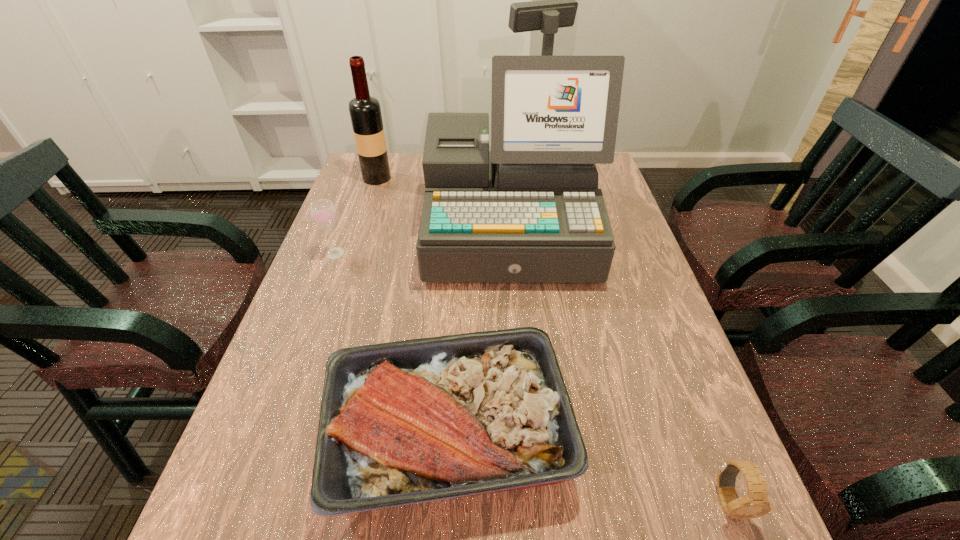
Locate an element on the screen. cash register positioned at the far edge is located at coordinates (529, 210).

Identify the location of wine bottle at the far edge. (365, 112).

I want to click on object that is at the near edge, so click(420, 420).

This screenshot has width=960, height=540. What are the coordinates of `wine bottle at the left edge` in the screenshot? It's located at (365, 112).

The height and width of the screenshot is (540, 960). What are the coordinates of `wineglass present at the left edge` in the screenshot? It's located at (323, 212).

Find the location of a particular element. This screenshot has width=960, height=540. tray that is at the left edge is located at coordinates (420, 420).

Locate an element on the screen. cash register situated at the right edge is located at coordinates (529, 210).

Find the location of a particular element. This screenshot has height=540, width=960. watch positioned at the right edge is located at coordinates (755, 504).

Find the location of a particular element. The height and width of the screenshot is (540, 960). object situated at the far left corner is located at coordinates pyautogui.click(x=365, y=112).

Identify the location of object that is at the near left corner. The height and width of the screenshot is (540, 960). (420, 420).